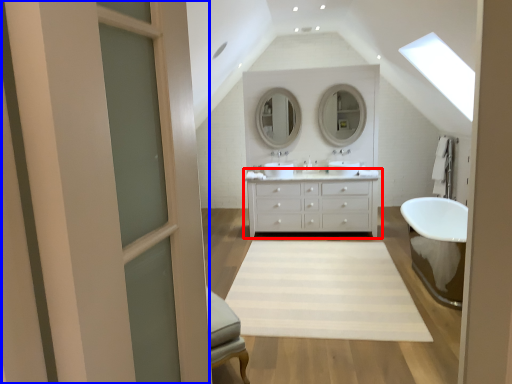
Question: Which of the following is the farthest to the observer, bathroom cabinet (highlighted by a red box) or screen door (highlighted by a blue box)?

Choices:
 (A) bathroom cabinet
 (B) screen door

Answer: (A)